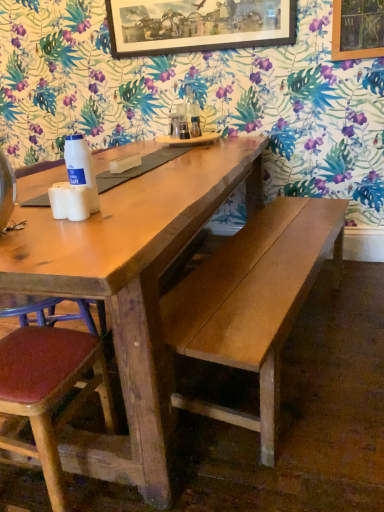
The image size is (384, 512). In order to click on blank space situated above brown wood chair at lower left (from a real-world perspective) in this screenshot , I will do `click(34, 356)`.